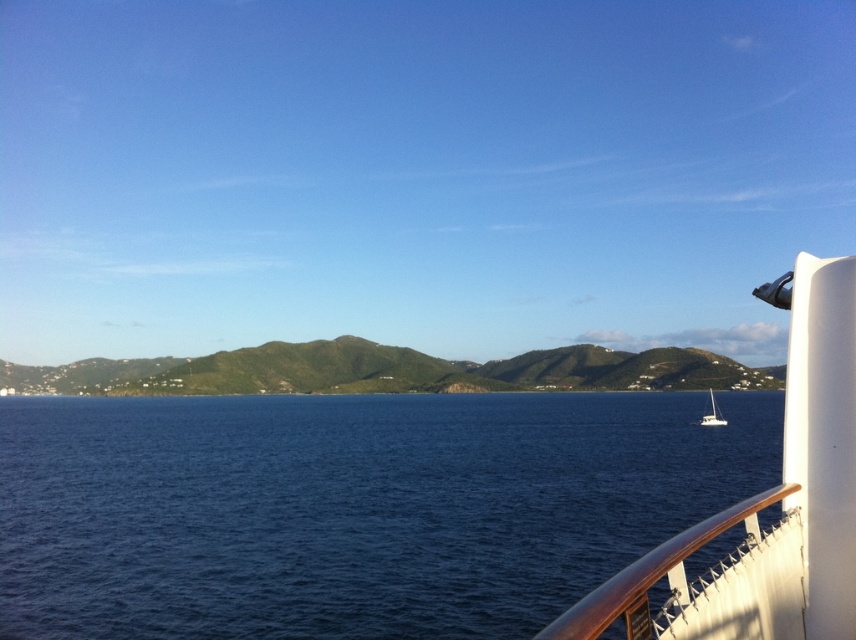
From the picture: Which of these two, deep blue water at center or wooden rail at right, stands taller?

deep blue water at center is taller.

Is the position of deep blue water at center more distant than that of wooden rail at right?

Yes, deep blue water at center is further from the viewer.

Is point (569, 412) in front of point (645, 570)?

That is False.

Where is `deep blue water at center`? Image resolution: width=856 pixels, height=640 pixels. deep blue water at center is located at coordinates (349, 508).

Between point (562, 630) and point (700, 417), which one is positioned in front?

Point (562, 630) is in front.

Is wooden rail at right behind white glossy sailboat at lower right?

No, it is not.

Does point (584, 620) come in front of point (715, 420)?

That is True.

Where is `wooden rail at right`? wooden rail at right is located at coordinates (651, 572).

Between white glossy sailboat at right and white glossy sailboat at lower right, which one is positioned higher?

Positioned higher is white glossy sailboat at right.

Is white glossy sailboat at right to the left of white glossy sailboat at lower right from the viewer's perspective?

Indeed, white glossy sailboat at right is positioned on the left side of white glossy sailboat at lower right.

Describe the element at coordinates (768, 502) in the screenshot. I see `white glossy sailboat at right` at that location.

Locate an element on the screen. The image size is (856, 640). white glossy sailboat at right is located at coordinates (768, 502).